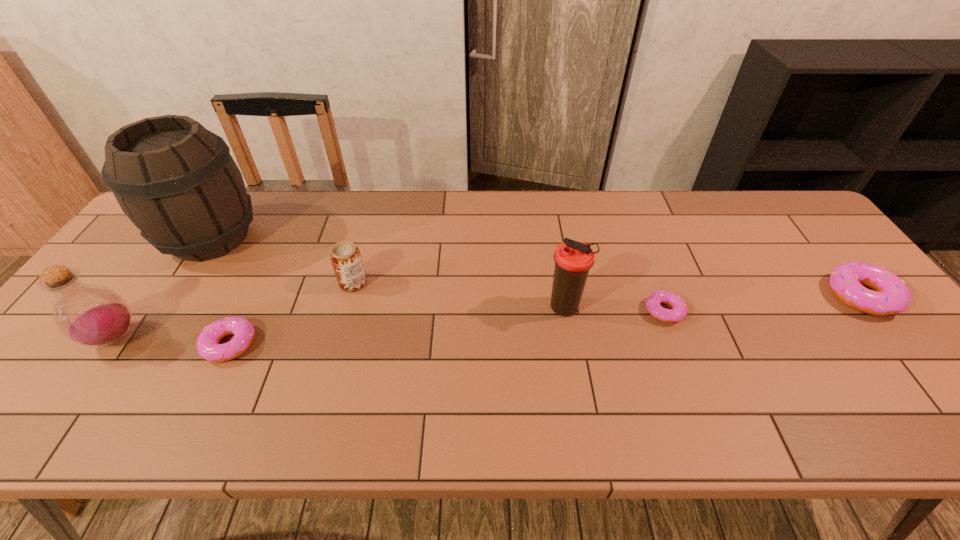
Locate an element on the screen. The image size is (960, 540). vacant position for inserting another doughnut evenly is located at coordinates pos(454,327).